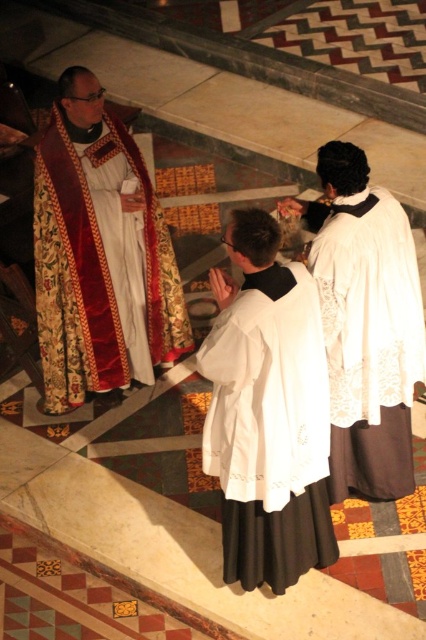
In the scene shown: You are a photographer positioned at the camera. You want to take a closeup shot of the velvet red and gold robe at upper left. Considering the robe is 3.84 meters away from you, what is the minimum distance your camera should be able to zoom to in order to capture the robe clearly without moving closer?

The velvet red and gold robe at upper left is 3.84 meters from the camera. To capture it clearly without moving closer, the camera must be able to zoom to at least 3.84 meters.

You are a visitor standing at the entrance of the cathedral. You want to walk from the velvet red and gold robe at upper left to the white embroidered robe at center. Is the distance between them sufficient for you to walk comfortably, considering an average walking space of 3 feet?

The distance between the velvet red and gold robe at upper left and the white embroidered robe at center is 4.86 feet, which is more than the average walking space of 3 feet, so yes, you can walk comfortably between them.